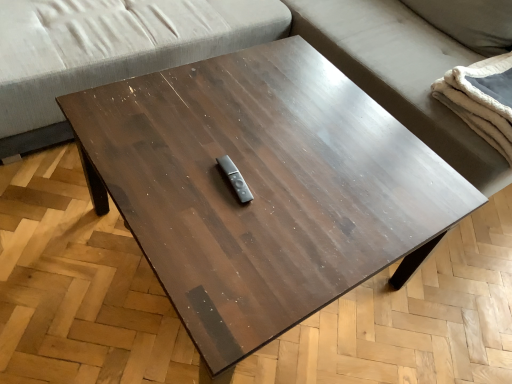
Question: Could you tell me if white fluffy blanket at right is turned towards gray fabric studio couch at upper center?

Choices:
 (A) yes
 (B) no

Answer: (A)

Question: Does white fluffy blanket at right lie in front of gray fabric studio couch at upper center?

Choices:
 (A) yes
 (B) no

Answer: (B)

Question: Is white fluffy blanket at right at the right side of gray fabric studio couch at upper center?

Choices:
 (A) no
 (B) yes

Answer: (B)

Question: Can you confirm if white fluffy blanket at right is wider than gray fabric studio couch at upper center?

Choices:
 (A) yes
 (B) no

Answer: (B)

Question: Considering the relative sizes of white fluffy blanket at right and gray fabric studio couch at upper center in the image provided, is white fluffy blanket at right taller than gray fabric studio couch at upper center?

Choices:
 (A) no
 (B) yes

Answer: (A)

Question: Is white fluffy blanket at right bigger than gray fabric studio couch at upper center?

Choices:
 (A) no
 (B) yes

Answer: (A)

Question: Is gray fabric couch at upper center smaller than white fluffy blanket at right?

Choices:
 (A) yes
 (B) no

Answer: (B)

Question: From the image's perspective, is gray fabric couch at upper center on white fluffy blanket at right?

Choices:
 (A) yes
 (B) no

Answer: (A)

Question: Is gray fabric couch at upper center located outside white fluffy blanket at right?

Choices:
 (A) no
 (B) yes

Answer: (B)

Question: Does gray fabric couch at upper center have a lesser height compared to white fluffy blanket at right?

Choices:
 (A) yes
 (B) no

Answer: (B)

Question: Is gray fabric couch at upper center placed right next to white fluffy blanket at right?

Choices:
 (A) yes
 (B) no

Answer: (B)

Question: Is gray fabric couch at upper center turned away from white fluffy blanket at right?

Choices:
 (A) yes
 (B) no

Answer: (B)

Question: Is gray fabric studio couch at upper center outside of gray fabric couch at upper center?

Choices:
 (A) no
 (B) yes

Answer: (A)